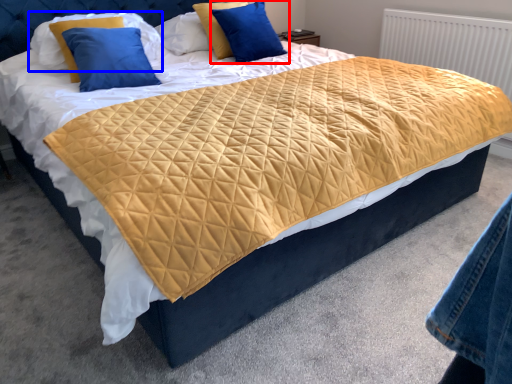
Question: Which object is closer to the camera taking this photo, pillow (highlighted by a red box) or pillow (highlighted by a blue box)?

Choices:
 (A) pillow
 (B) pillow

Answer: (B)